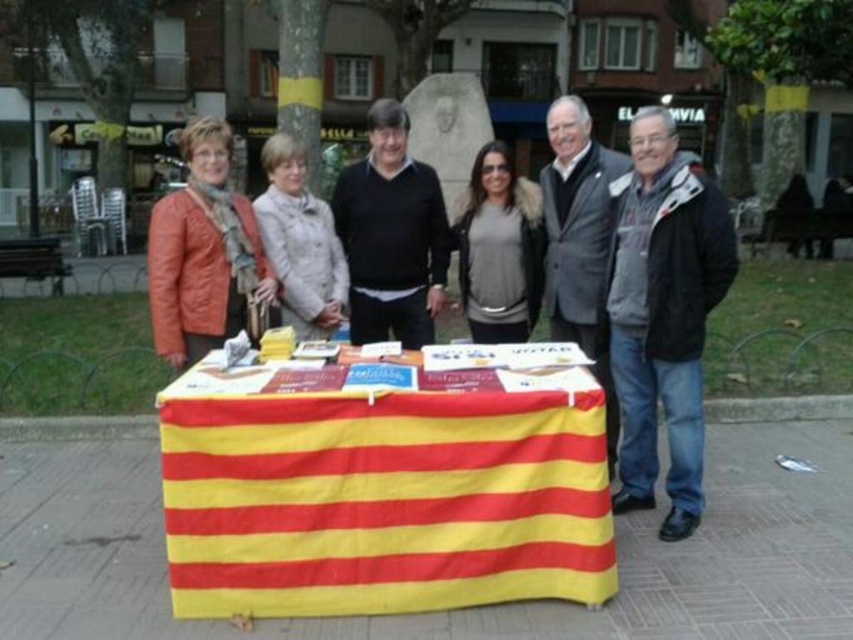
Can you confirm if orange leather jacket at left is positioned to the left of light beige fabric coat at center?

Yes, orange leather jacket at left is to the left of light beige fabric coat at center.

Where is `orange leather jacket at left`? This screenshot has width=853, height=640. orange leather jacket at left is located at coordinates (202, 252).

Is point (228, 131) closer to camera compared to point (306, 225)?

Yes, point (228, 131) is in front of point (306, 225).

What are the coordinates of `orange leather jacket at left` in the screenshot? It's located at (202, 252).

Which is above, gray woolen jacket at center or gray matte jacket at center?

Positioned higher is gray woolen jacket at center.

Is point (601, 292) farther from camera compared to point (497, 145)?

No, it is not.

Between point (601, 230) and point (509, 330), which one is positioned in front?

Point (601, 230)

At what (x,y) coordinates should I click in order to perform the action: click on gray woolen jacket at center. Please return your answer as a coordinate pair (x, y). Image resolution: width=853 pixels, height=640 pixels. Looking at the image, I should click on (578, 237).

How much distance is there between yellow/red striped cloth at center and light beige fabric coat at center?

4.35 feet

At what (x,y) coordinates should I click in order to perform the action: click on yellow/red striped cloth at center. Please return your answer as a coordinate pair (x, y). Image resolution: width=853 pixels, height=640 pixels. Looking at the image, I should click on (386, 484).

I want to click on yellow/red striped cloth at center, so click(x=386, y=484).